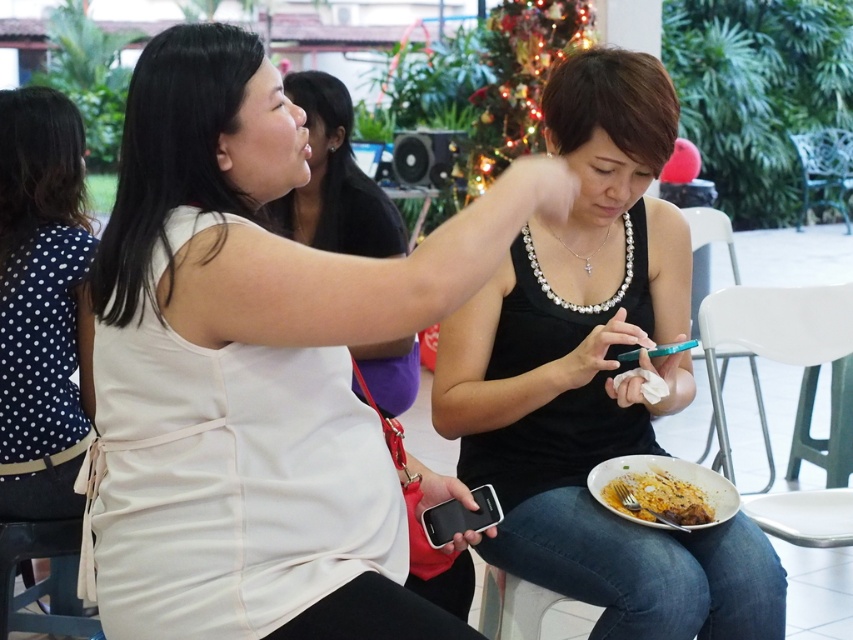
Question: Which is nearer to the white matte tank top at upper left?

Choices:
 (A) dark blue polka dot blouse at left
 (B) golden crispy chicken at lower right
 (C) white matte dress at upper left
 (D) pearl necklace at center

Answer: (B)

Question: Estimate the real-world distances between objects in this image. Which object is closer to the golden crispy chicken at lower right?

Choices:
 (A) pearl necklace at center
 (B) dark blue polka dot blouse at left
 (C) white plastic chair at right
 (D) matte black tank top at center

Answer: (D)

Question: Observing the image, what is the correct spatial positioning of white matte dress at upper left in reference to teal metal chair at right?

Choices:
 (A) above
 (B) below

Answer: (B)

Question: Does white plastic chair at right have a smaller size compared to golden crispy chicken at lower right?

Choices:
 (A) no
 (B) yes

Answer: (A)

Question: Which object is closer to the camera taking this photo?

Choices:
 (A) white plastic chair at right
 (B) white matte dress at upper left
 (C) teal metal chair at right

Answer: (B)

Question: Can you confirm if dark blue polka dot blouse at left is wider than metallic silver chair at lower left?

Choices:
 (A) no
 (B) yes

Answer: (A)